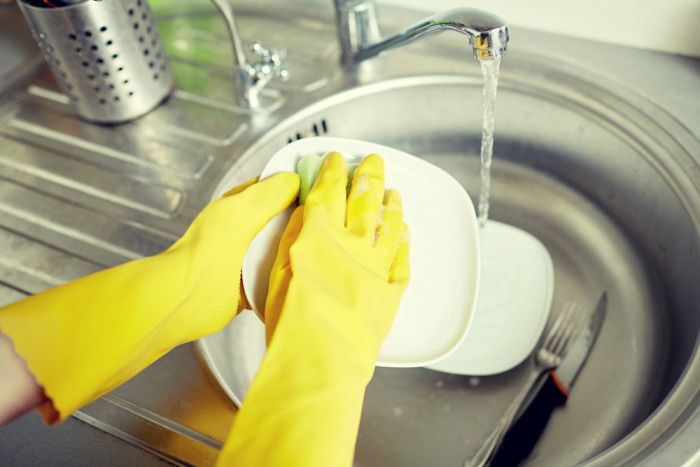
Find the location of a particular element. fork is located at coordinates (554, 338).